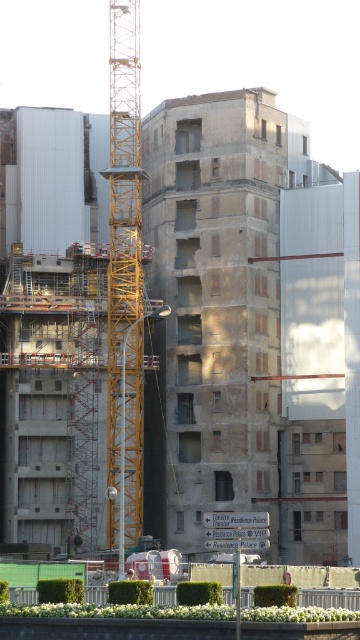
Question: In this image, where is yellow metallic crane at center located relative to concrete wall at center?

Choices:
 (A) left
 (B) right

Answer: (A)

Question: Can you confirm if yellow metallic crane at center is positioned above concrete wall at center?

Choices:
 (A) no
 (B) yes

Answer: (B)

Question: Among these points, which one is nearest to the camera?

Choices:
 (A) (208, 636)
 (B) (110, 122)

Answer: (A)

Question: Does yellow metallic crane at center come behind concrete wall at center?

Choices:
 (A) yes
 (B) no

Answer: (A)